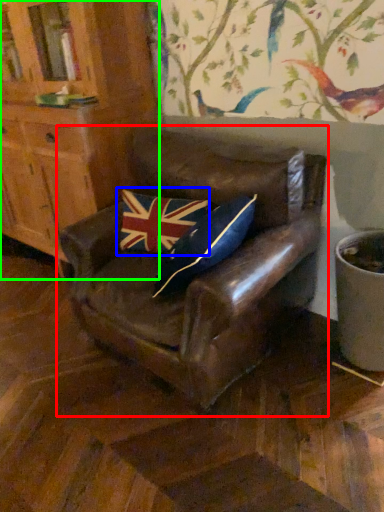
Question: Based on their relative distances, which object is farther from chair (highlighted by a red box)? Choose from flag (highlighted by a blue box) and cabinetry (highlighted by a green box).

Choices:
 (A) flag
 (B) cabinetry

Answer: (B)